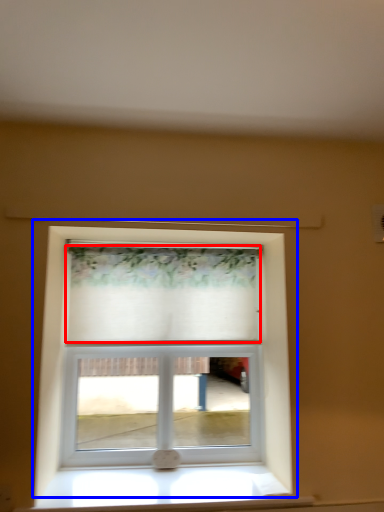
Question: Which of the following is the farthest to the observer, curtain (highlighted by a red box) or window (highlighted by a blue box)?

Choices:
 (A) curtain
 (B) window

Answer: (B)